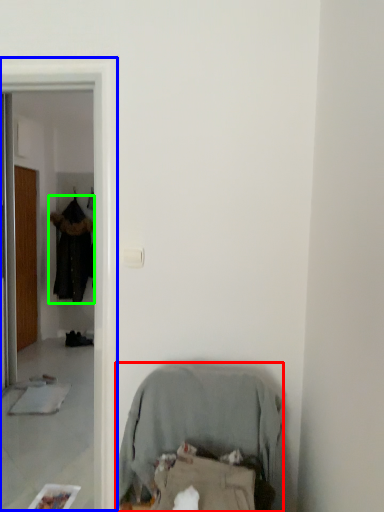
Question: Which is nearer to the furniture (highlighted by a red box)? screen door (highlighted by a blue box) or clothing (highlighted by a green box).

Choices:
 (A) screen door
 (B) clothing

Answer: (A)